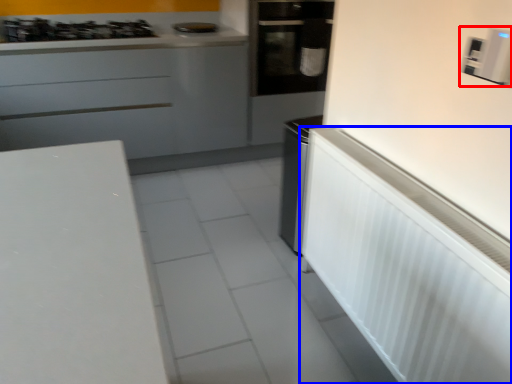
Question: Which of the following is the closest to the observer, appliance (highlighted by a red box) or appliance (highlighted by a blue box)?

Choices:
 (A) appliance
 (B) appliance

Answer: (B)